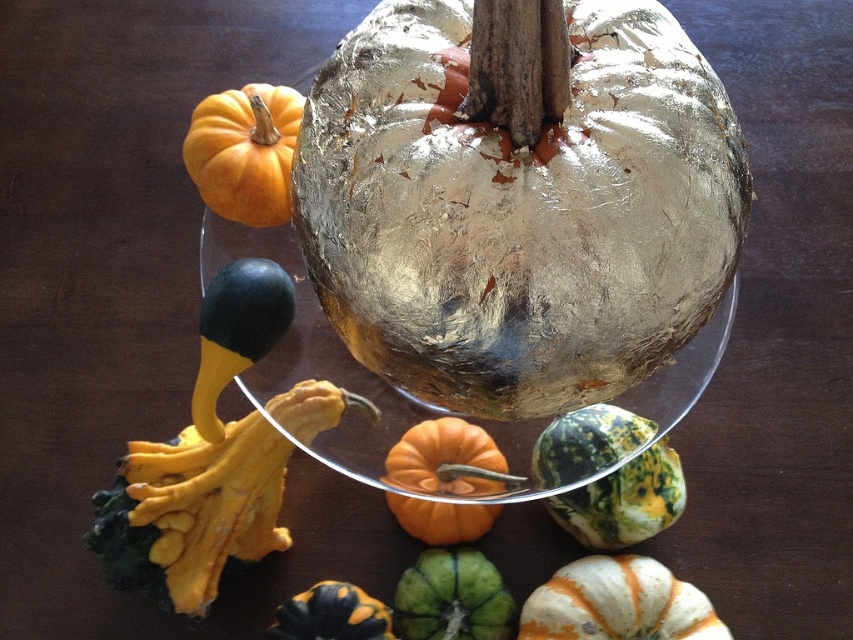
Is green speckled gourd at center thinner than speckled white pumpkin at lower right?

Yes.

Is point (665, 513) closer to viewer compared to point (712, 636)?

No, (665, 513) is behind (712, 636).

The height and width of the screenshot is (640, 853). I want to click on green speckled gourd at center, so click(624, 500).

The image size is (853, 640). What do you see at coordinates (244, 150) in the screenshot? I see `orange matte pumpkin at upper left` at bounding box center [244, 150].

At what (x,y) coordinates should I click in order to perform the action: click on orange matte pumpkin at upper left. Please return your answer as a coordinate pair (x, y). This screenshot has width=853, height=640. Looking at the image, I should click on (244, 150).

Where is `orange matte pumpkin at upper left`? orange matte pumpkin at upper left is located at coordinates (244, 150).

Who is lower down, green speckled gourd at center or orange and black striped gourd at lower center?

orange and black striped gourd at lower center

Which is more to the left, green speckled gourd at center or orange and black striped gourd at lower center?

Positioned to the left is orange and black striped gourd at lower center.

Is point (637, 476) farther from viewer compared to point (380, 612)?

Yes, it is.

What are the coordinates of `green speckled gourd at center` in the screenshot? It's located at (624, 500).